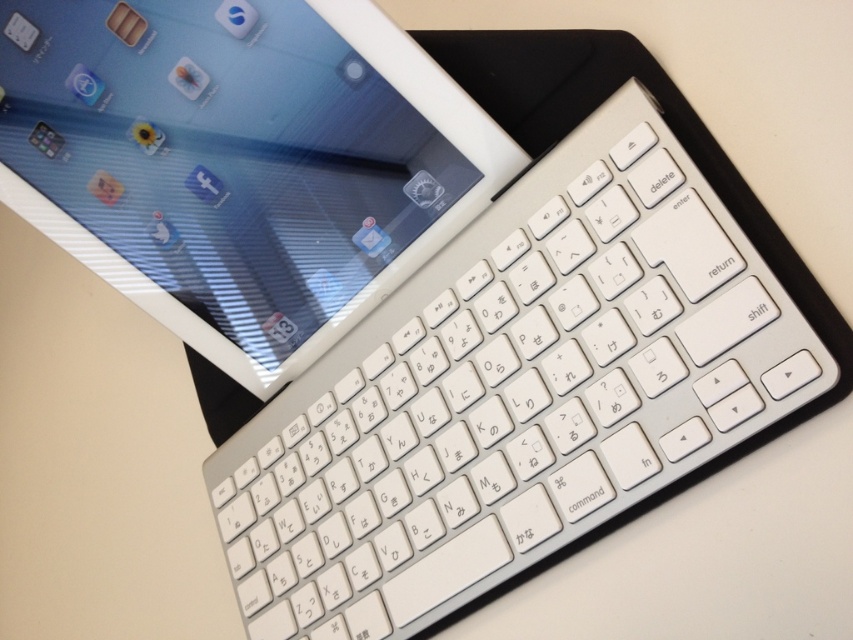
Between white plastic keyboard at upper center and white glossy tablet at upper left, which one appears on the left side from the viewer's perspective?

From the viewer's perspective, white glossy tablet at upper left appears more on the left side.

Does white plastic keyboard at upper center come in front of white glossy tablet at upper left?

Yes, white plastic keyboard at upper center is closer to the viewer.

The width and height of the screenshot is (853, 640). I want to click on white plastic keyboard at upper center, so pyautogui.click(x=514, y=392).